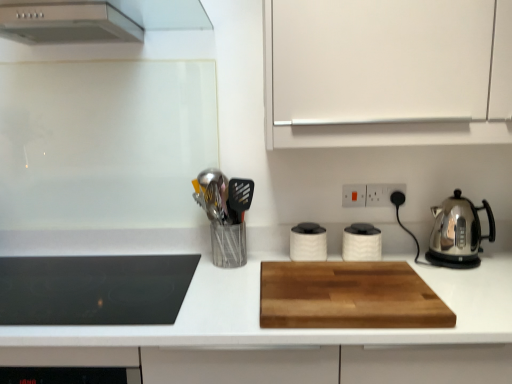
Question: Would you say stainless steel kettle at right, the 4th kitchen appliance viewed from the left, is to the left or to the right of white matte canister at center, which appears as the 3th kitchen appliance when viewed from the right, in the picture?

Choices:
 (A) left
 (B) right

Answer: (B)

Question: Is stainless steel kettle at right, the 4th kitchen appliance viewed from the left, in front of or behind white matte canister at center, which appears as the 3th kitchen appliance when viewed from the right, in the image?

Choices:
 (A) front
 (B) behind

Answer: (A)

Question: Estimate the real-world distances between objects in this image. Which object is closer to the black plastic electric outlet at upper right, which is the first electric outlet from right to left?

Choices:
 (A) wooden cutting board at center
 (B) stainless steel kettle at right, the 4th kitchen appliance viewed from the left
 (C) white matte canister at center, which is counted as the second kitchen appliance, starting from the left
 (D) metallic silver utensil holder at center-left
 (E) white plastic electric outlet at upper center, which is the second electric outlet in right-to-left order

Answer: (E)

Question: Considering the real-world distances, which object is farthest from the wooden cutting board at center?

Choices:
 (A) white matte cabinet at upper right
 (B) black plastic electric outlet at upper right, which is the 2th electric outlet from left to right
 (C) black glass cooktop at left, the 1th kitchen appliance when ordered from left to right
 (D) metallic silver utensil holder at center-left
 (E) white matte canister at center, the third kitchen appliance when ordered from left to right

Answer: (B)